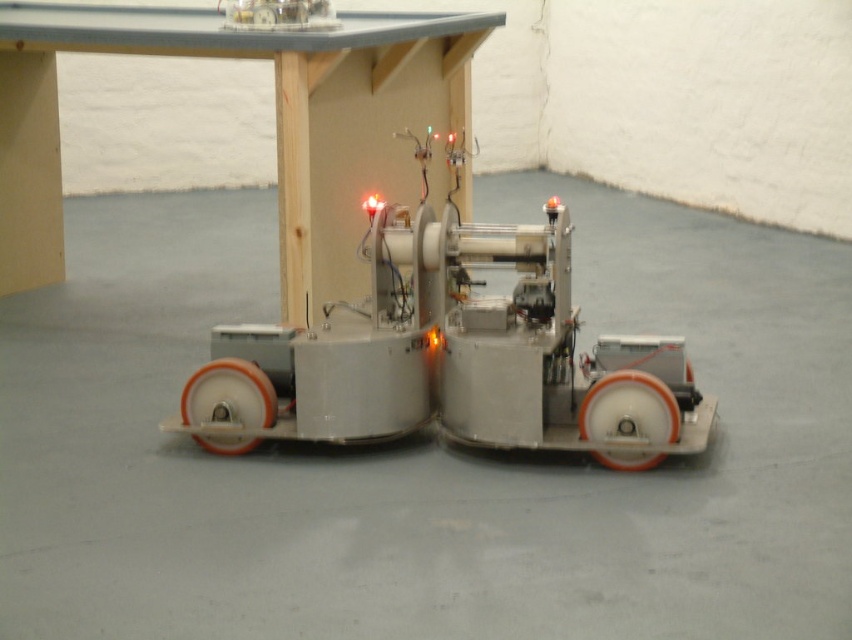
Looking at this image, who is more forward, [67,380] or [229,449]?

Point [229,449]

Does metallic robot at center appear on the right side of orange rubber wheel at lower left?

Correct, you'll find metallic robot at center to the right of orange rubber wheel at lower left.

Between point (188, 456) and point (210, 380), which one is positioned behind?

The point (188, 456) is more distant.

Image resolution: width=852 pixels, height=640 pixels. What are the coordinates of `metallic robot at center` in the screenshot? It's located at (422, 451).

Does orange rubber wheel at lower right have a greater width compared to orange rubber wheel at lower left?

No, orange rubber wheel at lower right is not wider than orange rubber wheel at lower left.

Which is more to the right, orange rubber wheel at lower right or orange rubber wheel at lower left?

From the viewer's perspective, orange rubber wheel at lower right appears more on the right side.

I want to click on orange rubber wheel at lower right, so [628, 410].

Where is `orange rubber wheel at lower right`? orange rubber wheel at lower right is located at coordinates (628, 410).

Is metallic robot at center below orange rubber wheel at lower right?

Indeed, metallic robot at center is positioned under orange rubber wheel at lower right.

Is point (153, 337) farther from camera compared to point (606, 390)?

Yes.

I want to click on metallic robot at center, so click(x=422, y=451).